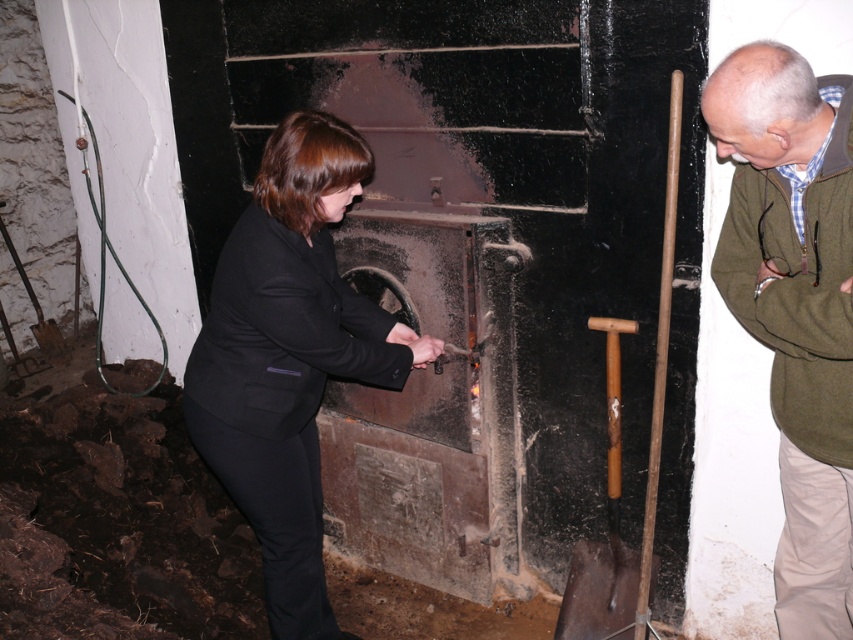
Question: Which of the following is the closest to the observer?

Choices:
 (A) green wool sweater at right
 (B) black matte suit at center

Answer: (A)

Question: Does black matte suit at center have a smaller size compared to green wool sweater at right?

Choices:
 (A) yes
 (B) no

Answer: (B)

Question: Among these objects, which one is nearest to the camera?

Choices:
 (A) rusty metal shovel at lower right
 (B) wooden shovel at right

Answer: (B)

Question: Does black matte suit at center have a greater width compared to green wool sweater at right?

Choices:
 (A) yes
 (B) no

Answer: (A)

Question: Is green wool sweater at right thinner than wooden shovel at right?

Choices:
 (A) no
 (B) yes

Answer: (A)

Question: Among these objects, which one is nearest to the camera?

Choices:
 (A) rusty metal shovel at lower right
 (B) black matte suit at center

Answer: (B)